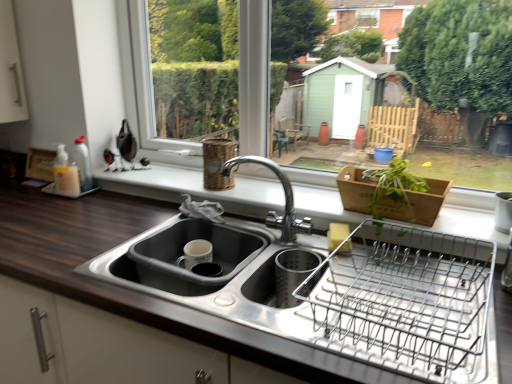
Question: Is wooden basket at center a part of white plastic window frame at upper center?

Choices:
 (A) no
 (B) yes

Answer: (A)

Question: Is white plastic window frame at upper center positioned before wooden basket at center?

Choices:
 (A) no
 (B) yes

Answer: (A)

Question: From the image's perspective, is white plastic window frame at upper center located above wooden basket at center?

Choices:
 (A) yes
 (B) no

Answer: (A)

Question: From a real-world perspective, is white plastic window frame at upper center under wooden basket at center?

Choices:
 (A) no
 (B) yes

Answer: (A)

Question: Is white plastic window frame at upper center to the right of wooden basket at center from the viewer's perspective?

Choices:
 (A) yes
 (B) no

Answer: (A)

Question: Is white plastic window frame at upper center thinner than wooden basket at center?

Choices:
 (A) no
 (B) yes

Answer: (B)

Question: Is chrome metallic faucet at center placed right next to wooden basket at center?

Choices:
 (A) yes
 (B) no

Answer: (B)

Question: Can you confirm if chrome metallic faucet at center is taller than wooden basket at center?

Choices:
 (A) yes
 (B) no

Answer: (A)

Question: Is chrome metallic faucet at center closer to camera compared to wooden basket at center?

Choices:
 (A) no
 (B) yes

Answer: (B)

Question: From a real-world perspective, is chrome metallic faucet at center positioned over wooden basket at center based on gravity?

Choices:
 (A) no
 (B) yes

Answer: (B)

Question: Considering the relative positions of chrome metallic faucet at center and wooden basket at center in the image provided, is chrome metallic faucet at center to the right of wooden basket at center from the viewer's perspective?

Choices:
 (A) yes
 (B) no

Answer: (B)

Question: Is chrome metallic faucet at center thinner than wooden basket at center?

Choices:
 (A) no
 (B) yes

Answer: (B)

Question: Can we say woven brown basket at upper center lies outside matte gray sink at lower center?

Choices:
 (A) yes
 (B) no

Answer: (A)